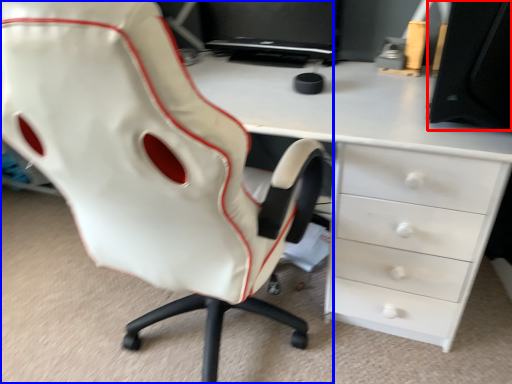
Question: Which object is closer to the camera taking this photo, desktop (highlighted by a red box) or chair (highlighted by a blue box)?

Choices:
 (A) desktop
 (B) chair

Answer: (B)